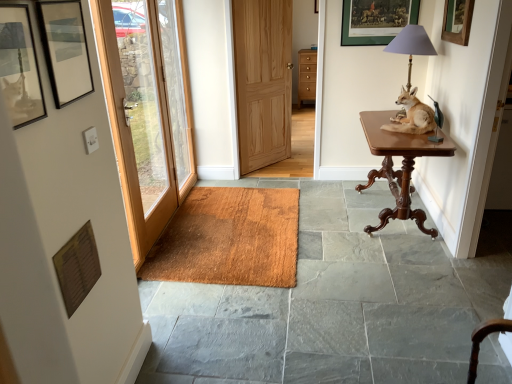
In order to click on free space in front of brown textured mat at center in this screenshot , I will do `click(282, 320)`.